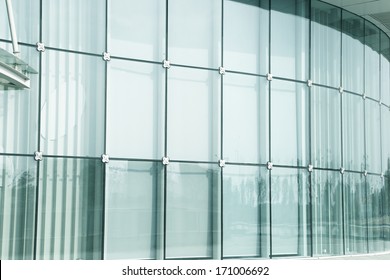
You are a GUI agent. You are given a task and a screenshot of the screen. Output one action in this format:
    pyautogui.click(x=<x>, y=<y>)
    Task: Click on the roller blinds
    Image resolution: width=390 pixels, height=280 pixels.
    Given the screenshot: What is the action you would take?
    pyautogui.click(x=153, y=111), pyautogui.click(x=193, y=109), pyautogui.click(x=246, y=111), pyautogui.click(x=293, y=114)